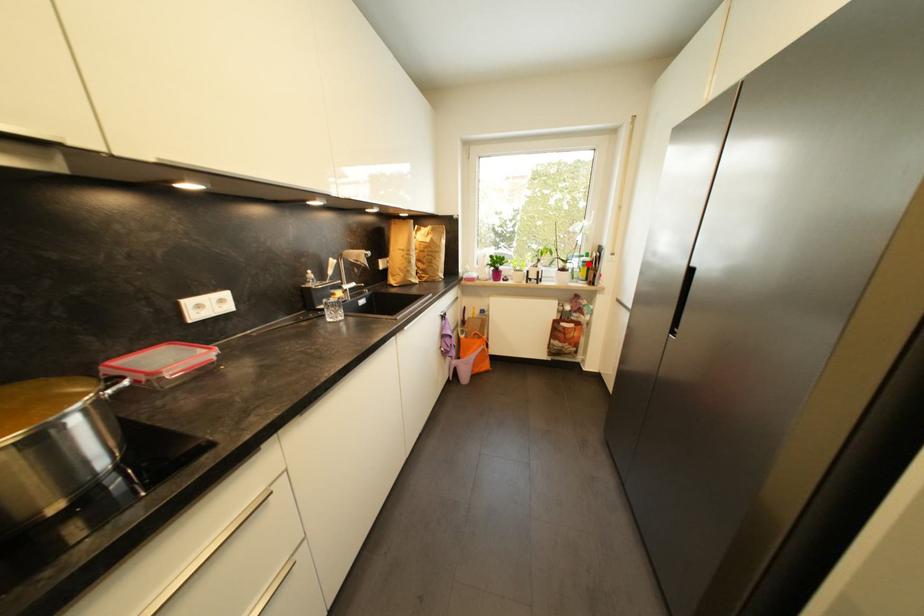
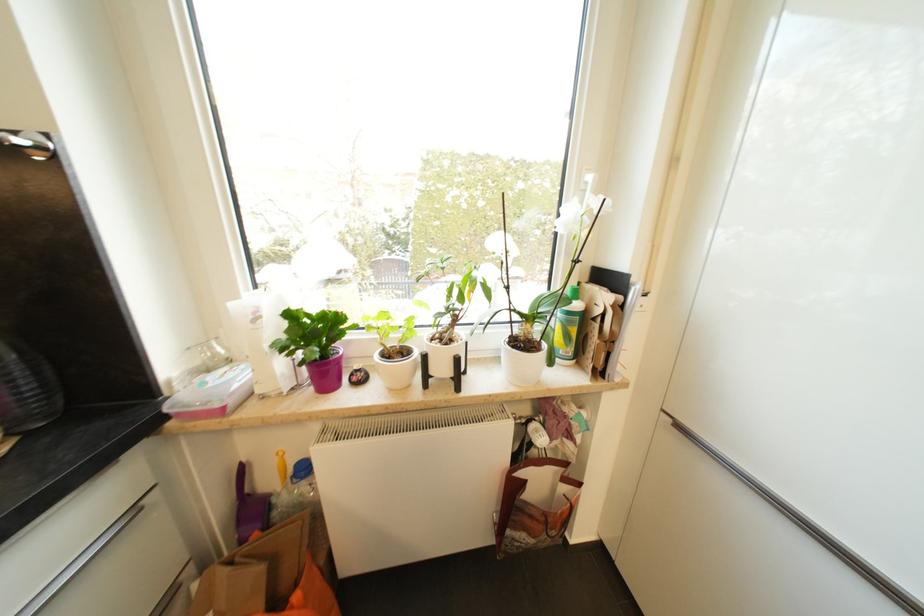
Locate, in the second image, the point that corresponds to the highlighted location in the first image.

(574, 315)